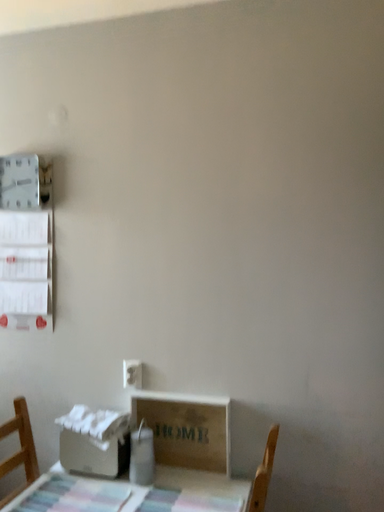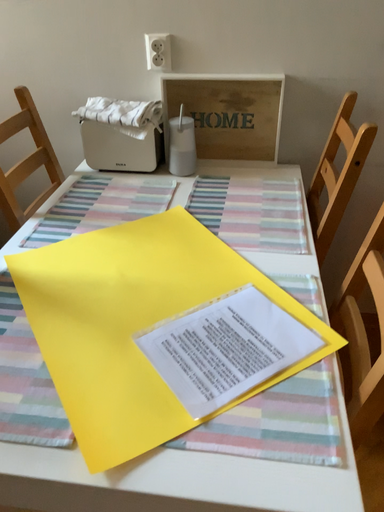
Question: Which way did the camera rotate in the video?

Choices:
 (A) rotated left
 (B) rotated right

Answer: (B)